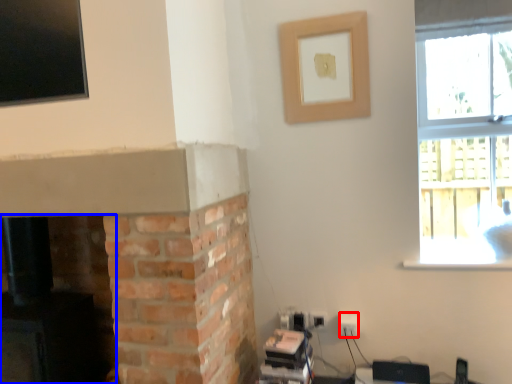
Question: Which object is closer to the camera taking this photo, electric outlet (highlighted by a red box) or fireplace (highlighted by a blue box)?

Choices:
 (A) electric outlet
 (B) fireplace

Answer: (B)